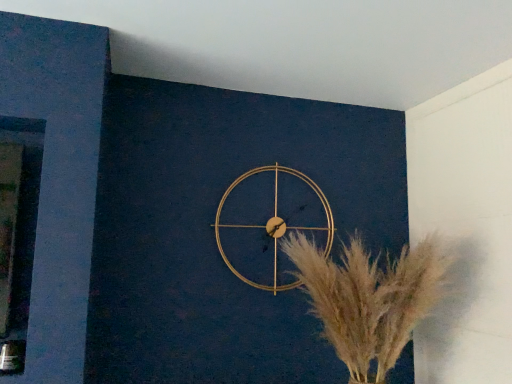
Question: Should I look upward or downward to see silvery metallic pampas grass at center?

Choices:
 (A) down
 (B) up

Answer: (A)

Question: Considering the relative sizes of silvery metallic pampas grass at center and gold metallic wall clock at center in the image provided, is silvery metallic pampas grass at center shorter than gold metallic wall clock at center?

Choices:
 (A) no
 (B) yes

Answer: (A)

Question: Considering the relative sizes of silvery metallic pampas grass at center and gold metallic wall clock at center in the image provided, is silvery metallic pampas grass at center smaller than gold metallic wall clock at center?

Choices:
 (A) yes
 (B) no

Answer: (B)

Question: Can we say silvery metallic pampas grass at center lies outside gold metallic wall clock at center?

Choices:
 (A) no
 (B) yes

Answer: (B)

Question: Is silvery metallic pampas grass at center next to gold metallic wall clock at center and touching it?

Choices:
 (A) yes
 (B) no

Answer: (B)

Question: Considering the relative sizes of silvery metallic pampas grass at center and gold metallic wall clock at center in the image provided, is silvery metallic pampas grass at center wider than gold metallic wall clock at center?

Choices:
 (A) no
 (B) yes

Answer: (B)

Question: Considering the relative positions of silvery metallic pampas grass at center and gold metallic wall clock at center in the image provided, is silvery metallic pampas grass at center to the right of gold metallic wall clock at center from the viewer's perspective?

Choices:
 (A) no
 (B) yes

Answer: (B)

Question: Can you confirm if gold metallic wall clock at center is thinner than silvery metallic pampas grass at center?

Choices:
 (A) no
 (B) yes

Answer: (B)

Question: Can you confirm if gold metallic wall clock at center is shorter than silvery metallic pampas grass at center?

Choices:
 (A) no
 (B) yes

Answer: (B)

Question: Considering the relative sizes of gold metallic wall clock at center and silvery metallic pampas grass at center in the image provided, is gold metallic wall clock at center wider than silvery metallic pampas grass at center?

Choices:
 (A) no
 (B) yes

Answer: (A)

Question: From a real-world perspective, is gold metallic wall clock at center under silvery metallic pampas grass at center?

Choices:
 (A) no
 (B) yes

Answer: (A)

Question: From a real-world perspective, does gold metallic wall clock at center stand above silvery metallic pampas grass at center?

Choices:
 (A) yes
 (B) no

Answer: (A)

Question: Considering the relative positions of gold metallic wall clock at center and silvery metallic pampas grass at center in the image provided, is gold metallic wall clock at center in front of silvery metallic pampas grass at center?

Choices:
 (A) yes
 (B) no

Answer: (B)

Question: From a real-world perspective, relative to silvery metallic pampas grass at center, is gold metallic wall clock at center vertically above or below?

Choices:
 (A) above
 (B) below

Answer: (A)